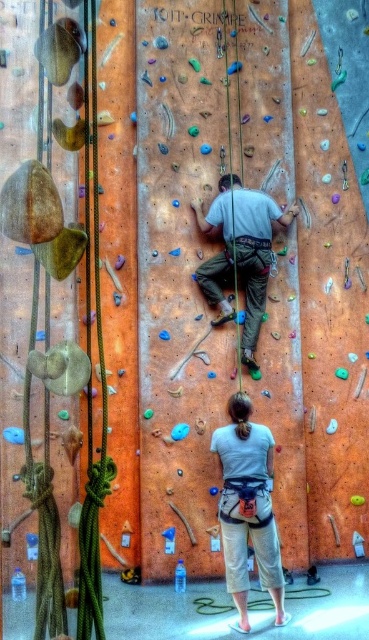
Question: Can you confirm if light beige pants at lower center is positioned to the right of green fabric pants at center?

Choices:
 (A) yes
 (B) no

Answer: (A)

Question: In this image, where is light beige pants at lower center located relative to green fabric pants at center?

Choices:
 (A) right
 (B) left

Answer: (A)

Question: Does light beige pants at lower center come in front of green fabric pants at center?

Choices:
 (A) yes
 (B) no

Answer: (A)

Question: Which point is farther from the camera taking this photo?

Choices:
 (A) (236, 570)
 (B) (212, 291)

Answer: (B)

Question: Which object appears farthest from the camera in this image?

Choices:
 (A) green fabric pants at center
 (B) light beige pants at lower center

Answer: (A)

Question: Among these objects, which one is nearest to the camera?

Choices:
 (A) green fabric pants at center
 (B) light beige pants at lower center

Answer: (B)